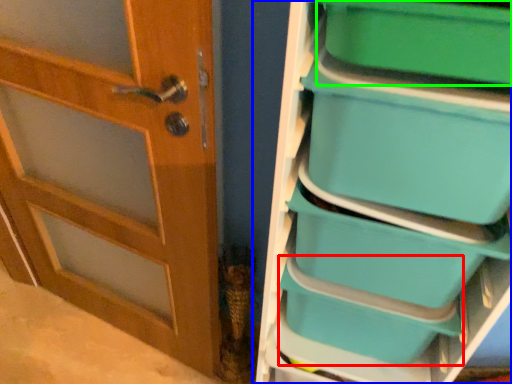
Question: Which object is the farthest from storage box (highlighted by a red box)? Choose among these: shelf (highlighted by a blue box) or storage box (highlighted by a green box).

Choices:
 (A) shelf
 (B) storage box

Answer: (B)